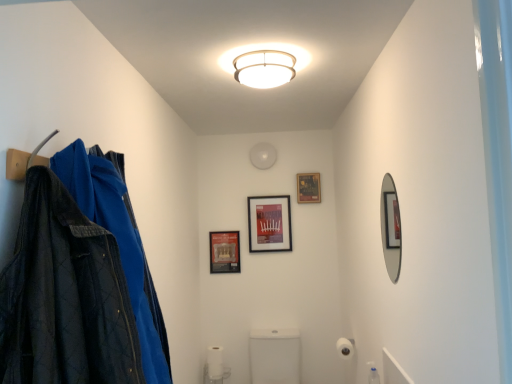
Question: From a real-world perspective, is matte black picture frame at center, placed as the second picture frame when sorted from left to right, located beneath white matte toilet paper at lower center, the 2th toilet paper from the top?

Choices:
 (A) yes
 (B) no

Answer: (B)

Question: From a real-world perspective, is matte black picture frame at center, the 2th picture frame positioned from the right, positioned over white matte toilet paper at lower center, the 2th toilet paper from the top, based on gravity?

Choices:
 (A) no
 (B) yes

Answer: (B)

Question: Is matte black picture frame at center, placed as the second picture frame when sorted from left to right, positioned in front of white matte toilet paper at lower center, which is the second toilet paper in right-to-left order?

Choices:
 (A) no
 (B) yes

Answer: (A)

Question: Considering the relative sizes of matte black picture frame at center, the 2th picture frame positioned from the right, and white matte toilet paper at lower center, the 1th toilet paper when ordered from left to right, in the image provided, is matte black picture frame at center, the 2th picture frame positioned from the right, taller than white matte toilet paper at lower center, the 1th toilet paper when ordered from left to right,?

Choices:
 (A) yes
 (B) no

Answer: (A)

Question: Can you confirm if matte black picture frame at center, placed as the second picture frame when sorted from left to right, is positioned to the right of white matte toilet paper at lower center, the 1th toilet paper when ordered from left to right?

Choices:
 (A) no
 (B) yes

Answer: (B)

Question: Considering the positions of white glossy toilet at center and silver-framed mirror at right in the image, is white glossy toilet at center taller or shorter than silver-framed mirror at right?

Choices:
 (A) tall
 (B) short

Answer: (B)

Question: Based on their sizes in the image, would you say white glossy toilet at center is bigger or smaller than silver-framed mirror at right?

Choices:
 (A) small
 (B) big

Answer: (B)

Question: From the image's perspective, is white glossy toilet at center positioned above or below silver-framed mirror at right?

Choices:
 (A) above
 (B) below

Answer: (B)

Question: Looking at their shapes, would you say white glossy toilet at center is wider or thinner than silver-framed mirror at right?

Choices:
 (A) thin
 (B) wide

Answer: (B)

Question: Is white glossy toilet at center to the left or to the right of matte black picture frame at upper center, placed as the 3th picture frame when sorted from left to right, in the image?

Choices:
 (A) right
 (B) left

Answer: (B)

Question: Is white glossy toilet at center bigger or smaller than matte black picture frame at upper center, acting as the 1th picture frame starting from the right?

Choices:
 (A) big
 (B) small

Answer: (A)

Question: Considering the positions of white glossy toilet at center and matte black picture frame at upper center, acting as the 1th picture frame starting from the right, in the image, is white glossy toilet at center taller or shorter than matte black picture frame at upper center, acting as the 1th picture frame starting from the right,?

Choices:
 (A) tall
 (B) short

Answer: (A)

Question: Considering the positions of point pyautogui.click(x=281, y=329) and point pyautogui.click(x=312, y=192), is point pyautogui.click(x=281, y=329) closer or farther from the camera than point pyautogui.click(x=312, y=192)?

Choices:
 (A) closer
 (B) farther

Answer: (A)

Question: Looking at their shapes, would you say matte black picture frame at center, arranged as the first picture frame when viewed from the left, is wider or thinner than white matte toilet paper at lower center, which is the second toilet paper in right-to-left order?

Choices:
 (A) thin
 (B) wide

Answer: (A)

Question: From the image's perspective, is matte black picture frame at center, arranged as the first picture frame when viewed from the left, positioned above or below white matte toilet paper at lower center, the 1th toilet paper from the back?

Choices:
 (A) below
 (B) above

Answer: (B)